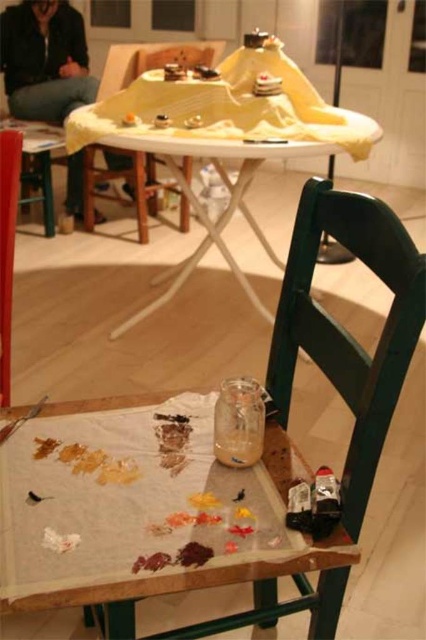
Is the position of green wooden chair at lower right less distant than that of black leather jacket at upper left?

Yes.

This screenshot has width=426, height=640. What do you see at coordinates (344, 330) in the screenshot?
I see `green wooden chair at lower right` at bounding box center [344, 330].

I want to click on green wooden chair at lower right, so click(344, 330).

Based on the photo, can you confirm if black leather jacket at upper left is positioned to the right of green wooden chair at center?

In fact, black leather jacket at upper left is to the left of green wooden chair at center.

Between point (78, 192) and point (118, 45), which one is positioned behind?

Positioned behind is point (78, 192).

Is point (80, 156) behind point (137, 193)?

Yes.

Find the location of `black leather jacket at upper left`. black leather jacket at upper left is located at coordinates coord(45,60).

Between point (345, 236) and point (181, 118), which one is positioned in front?

Point (345, 236)

Is point (304, 246) positioned behind point (77, 122)?

No, it is not.

Locate an element on the screen. The height and width of the screenshot is (640, 426). green wooden chair at lower right is located at coordinates (344, 330).